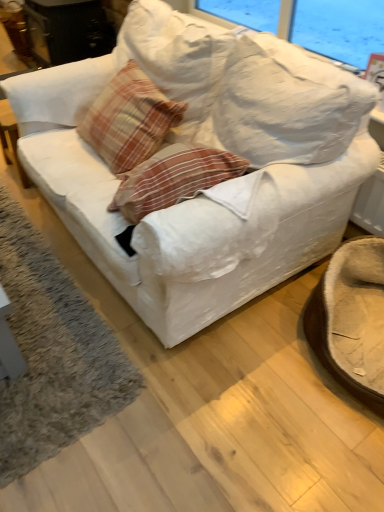
Identify the location of vacant area that lies between white fabric couch at center and brown fuzzy swivel chair at lower right. This screenshot has height=512, width=384. pyautogui.click(x=259, y=388).